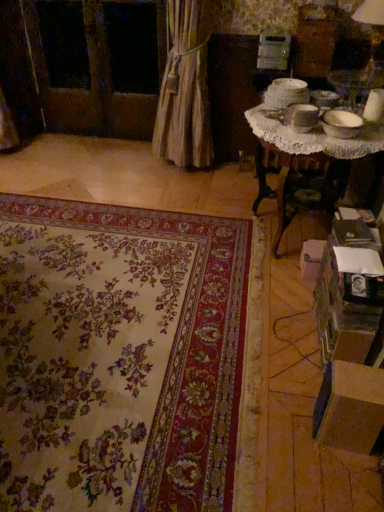
Where is `free space in front of brown cardboard box at lower right, the 1th cardboard box from the bottom`? free space in front of brown cardboard box at lower right, the 1th cardboard box from the bottom is located at coordinates (349, 473).